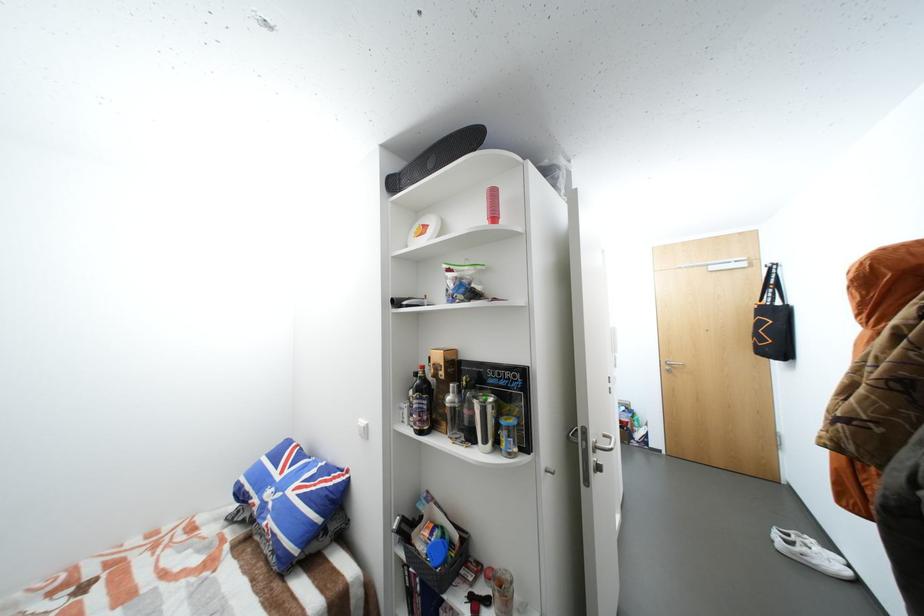
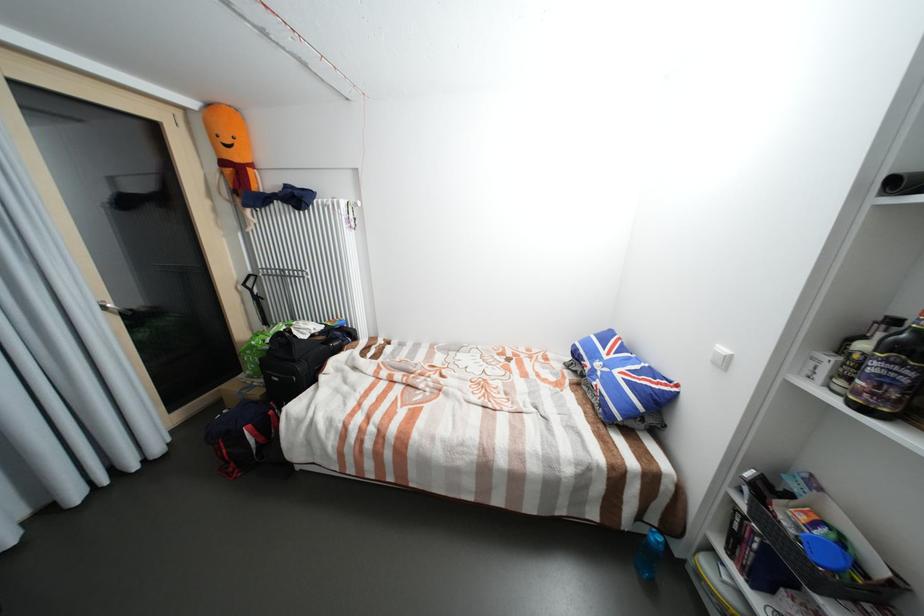
In the second image, find the point that corresponds to [423,375] in the first image.

(901, 322)